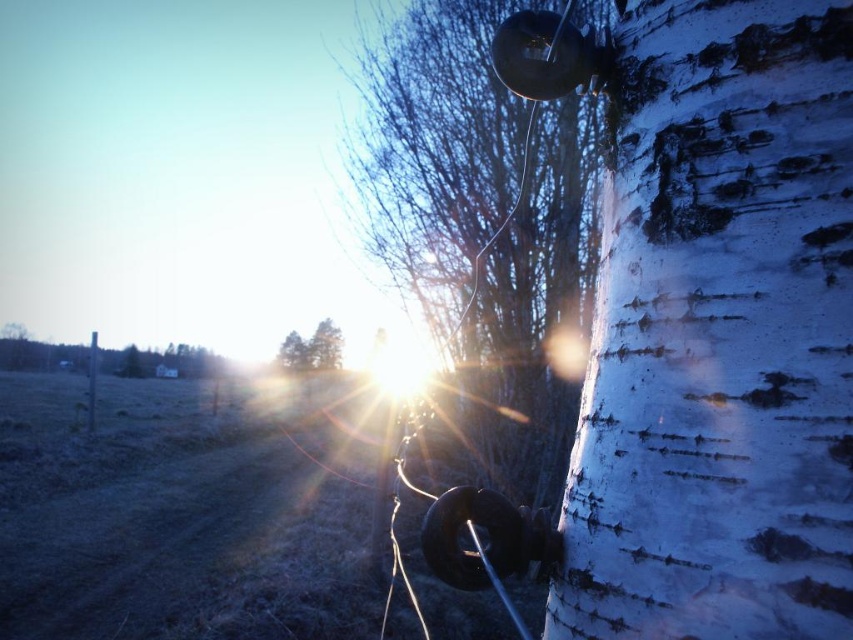
You are standing in the rural scene depicted in the image. You notice a point marked at coordinates [718,333]. What does this point represent?

The point at coordinates [718,333] corresponds to the white textured bark at right.